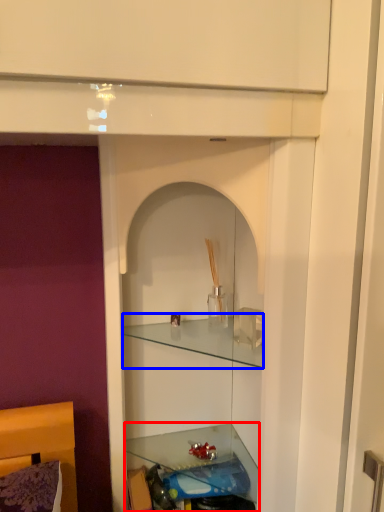
Question: Which of the following is the closest to the observer, shelf (highlighted by a red box) or cabinet (highlighted by a blue box)?

Choices:
 (A) shelf
 (B) cabinet

Answer: (B)